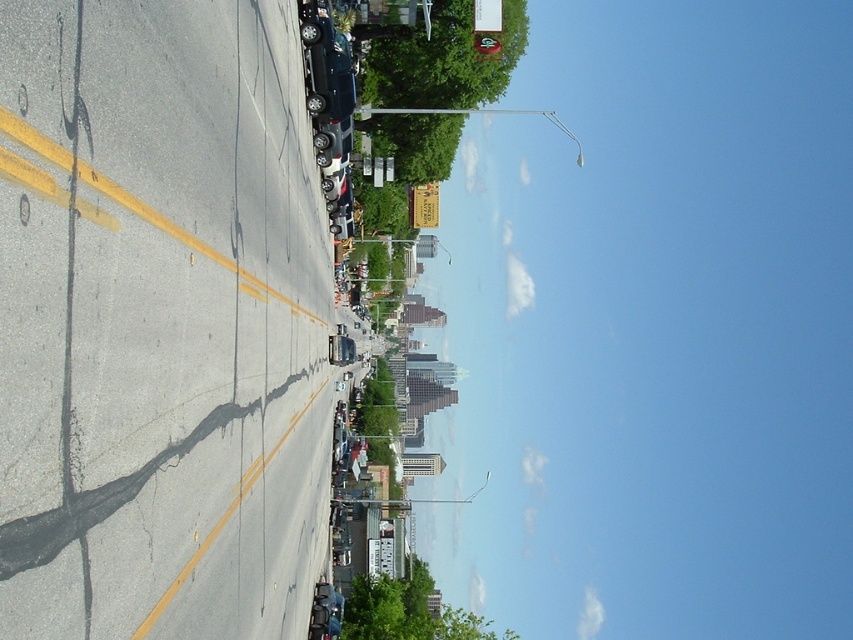
In order to click on satin black car at upper center in this screenshot , I will do `click(329, 81)`.

Can you confirm if satin black car at upper center is smaller than shiny silver car at center?

Yes.

Is point (312, 109) positioned behind point (334, 141)?

That is False.

Find the location of a particular element. Image resolution: width=853 pixels, height=640 pixels. satin black car at upper center is located at coordinates (329, 81).

In the scene shown: Does asphalt at center appear under shiny silver car at center?

Correct, asphalt at center is located below shiny silver car at center.

Does asphalt at center lie in front of shiny silver car at center?

Yes, asphalt at center is in front of shiny silver car at center.

Image resolution: width=853 pixels, height=640 pixels. Describe the element at coordinates (160, 321) in the screenshot. I see `asphalt at center` at that location.

The image size is (853, 640). What are the coordinates of `asphalt at center` in the screenshot? It's located at (160, 321).

Does cracked asphalt at center appear over shiny silver car at center?

Incorrect, cracked asphalt at center is not positioned above shiny silver car at center.

I want to click on cracked asphalt at center, so click(225, 516).

Locate an element on the screen. This screenshot has width=853, height=640. cracked asphalt at center is located at coordinates (225, 516).

Find the location of a particular element. cracked asphalt at center is located at coordinates (225, 516).